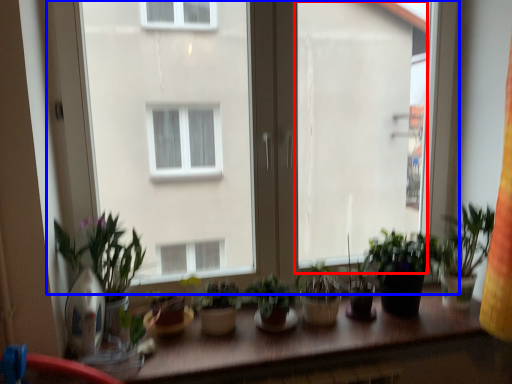
Question: Which object appears farthest to the camera in this image, window screen (highlighted by a red box) or window (highlighted by a blue box)?

Choices:
 (A) window screen
 (B) window

Answer: (A)